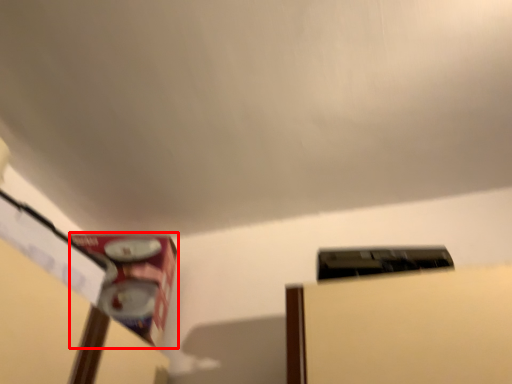
Question: From the image's perspective, what is the correct spatial relationship of water heater (annotated by the red box) in relation to water heater?

Choices:
 (A) above
 (B) below

Answer: (B)